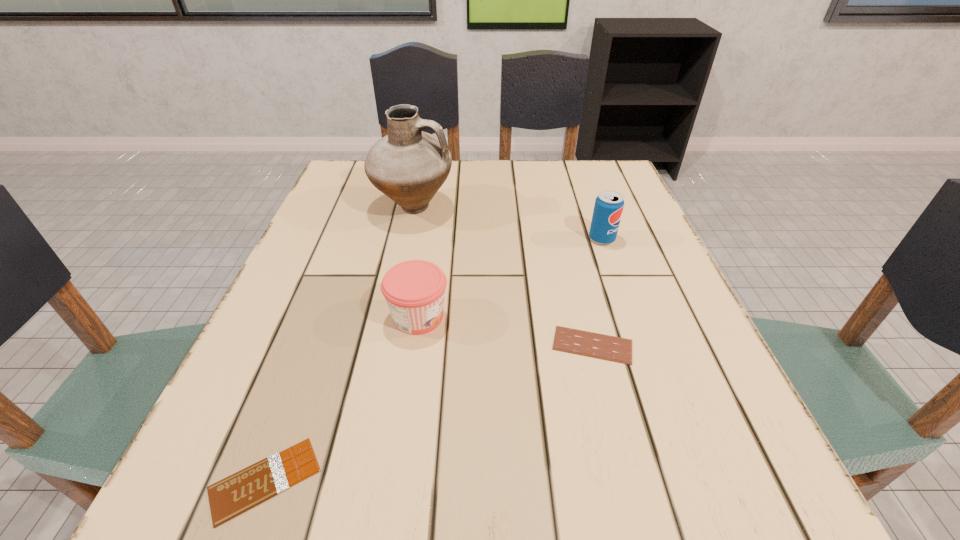
Image resolution: width=960 pixels, height=540 pixels. I want to click on vacant space at the far edge of the desktop, so click(481, 160).

Identify the location of vacant area at the left edge of the desktop. Image resolution: width=960 pixels, height=540 pixels. (304, 304).

You are a GUI agent. You are given a task and a screenshot of the screen. Output one action in this format:
    pyautogui.click(x=<x>, y=<y>)
    Task: Click on the vacant space at the right edge of the desktop
    
    Given the screenshot: What is the action you would take?
    pyautogui.click(x=666, y=319)

The width and height of the screenshot is (960, 540). I want to click on free space at the near left corner of the desktop, so click(282, 530).

Find the location of `blank space at the far right corner of the desktop`. blank space at the far right corner of the desktop is located at coordinates (571, 181).

Identify the location of free region at the near right corner of the desktop. The width and height of the screenshot is (960, 540). (754, 507).

At what (x,y) coordinates should I click in order to perform the action: click on free space between the soda can and the shortest object. Please return your answer as a coordinate pair (x, y). The height and width of the screenshot is (540, 960). Looking at the image, I should click on (434, 359).

Where is `vacant space in between the soda can and the pitcher`? vacant space in between the soda can and the pitcher is located at coordinates (508, 224).

This screenshot has width=960, height=540. What are the coordinates of `blank region between the jam and the soda can` in the screenshot? It's located at (510, 278).

This screenshot has height=540, width=960. Find the location of `vacant point located between the taller chocolate bar and the pitcher`. vacant point located between the taller chocolate bar and the pitcher is located at coordinates (503, 277).